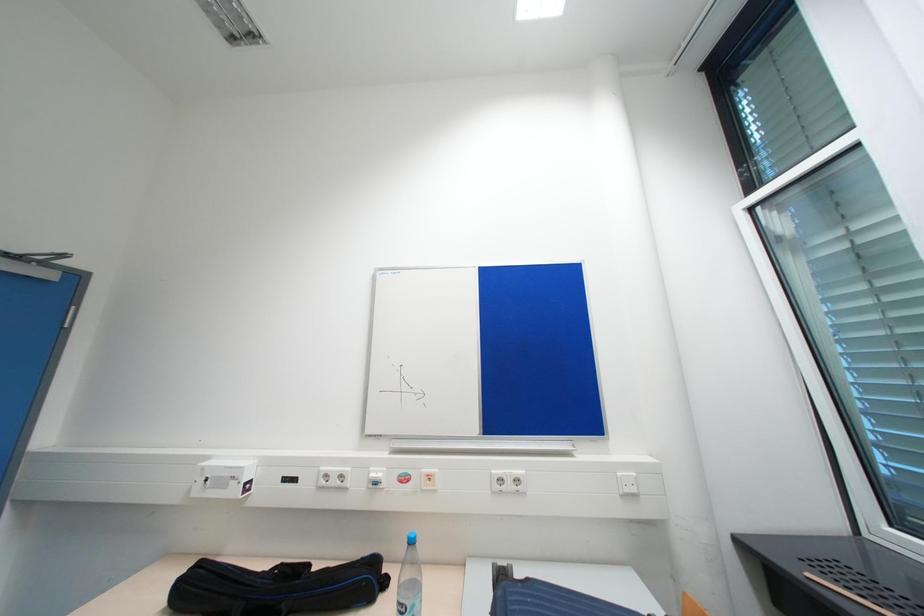
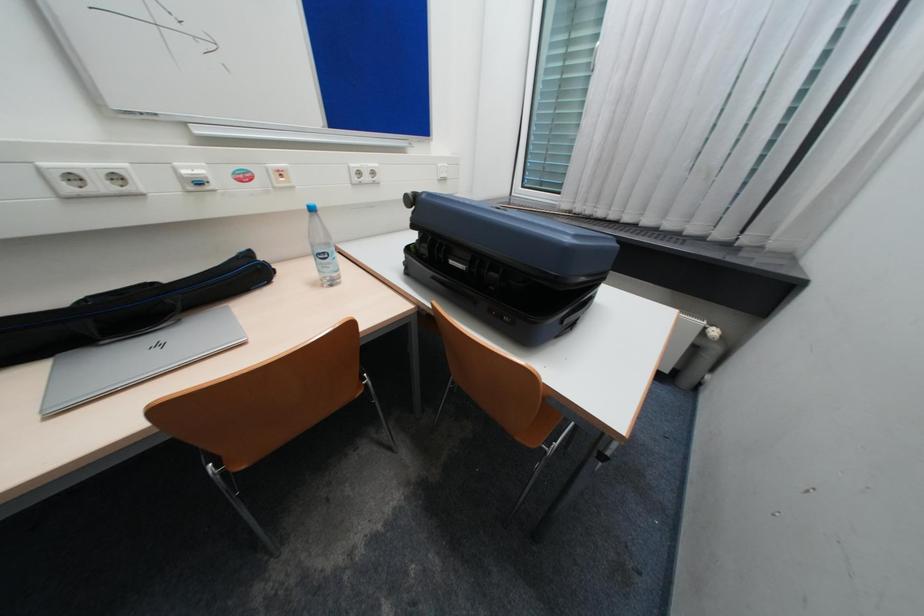
The images are taken continuously from a first-person perspective. In which direction is your viewpoint rotating?

The camera's rotation is toward right-down.